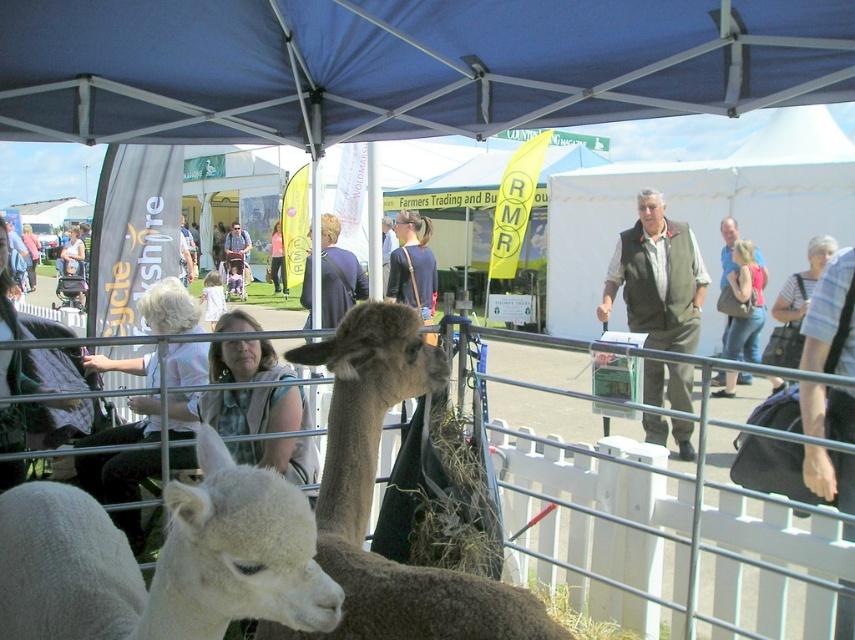
Can you confirm if blue fabric canopy at upper center is smaller than matte black shirt at center?

Yes, blue fabric canopy at upper center is smaller than matte black shirt at center.

Who is taller, blue fabric canopy at upper center or matte black shirt at center?

matte black shirt at center is taller.

Between point (558, 52) and point (234, 237), which one is positioned in front?

Positioned in front is point (558, 52).

Find the location of a particular element. This screenshot has width=855, height=640. blue fabric canopy at upper center is located at coordinates (402, 65).

Which of these two, brown woolen alpaca at center or denim jacket at upper right, stands taller?

denim jacket at upper right

Describe the element at coordinates (372, 493) in the screenshot. I see `brown woolen alpaca at center` at that location.

The height and width of the screenshot is (640, 855). I want to click on brown woolen alpaca at center, so (372, 493).

Does denim jacket at upper right have a greater height compared to light brown hair at center?

No, denim jacket at upper right is not taller than light brown hair at center.

Is point (724, 337) more distant than point (282, 292)?

That is False.

Where is `denim jacket at upper right`? The height and width of the screenshot is (640, 855). denim jacket at upper right is located at coordinates (727, 246).